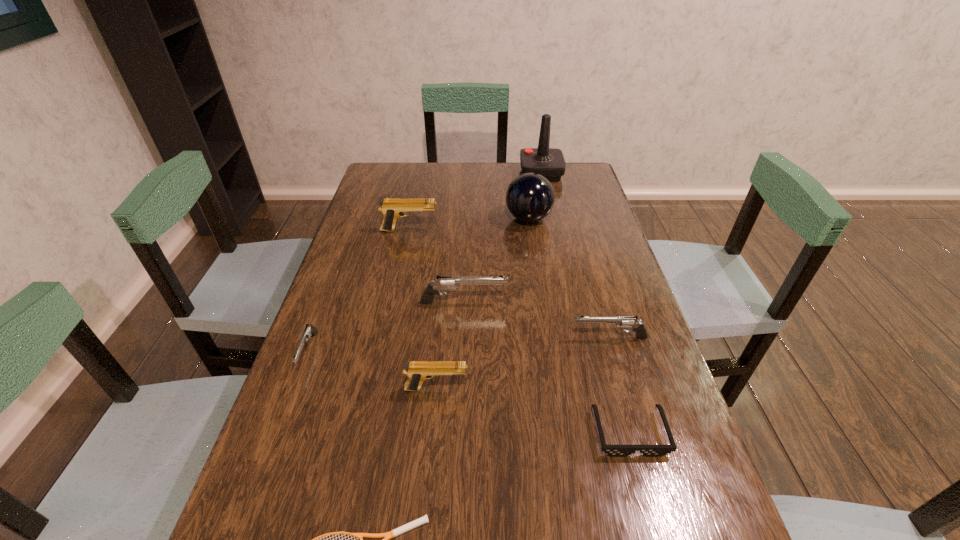
Where is `the rightmost silver pistol`? This screenshot has height=540, width=960. the rightmost silver pistol is located at coordinates (623, 322).

At what (x,y) coordinates should I click in order to perform the action: click on the fourth tallest pistol. Please return your answer as a coordinate pair (x, y). The width and height of the screenshot is (960, 540). Looking at the image, I should click on (623, 322).

The height and width of the screenshot is (540, 960). What are the coordinates of `the seventh tallest object` in the screenshot? It's located at (309, 330).

Where is `the smallest silver pistol`? the smallest silver pistol is located at coordinates (309, 330).

At what (x,y) coordinates should I click in order to perform the action: click on the second nearest object. Please return your answer as a coordinate pair (x, y). This screenshot has height=540, width=960. Looking at the image, I should click on (613, 450).

Where is `the second shortest object`? the second shortest object is located at coordinates (613, 450).

Image resolution: width=960 pixels, height=540 pixels. I want to click on vacant position located 0.380m on the left of the joystick, so click(420, 173).

The image size is (960, 540). I want to click on free space located 0.270m on the side of the second tallest object with the finger holes, so click(422, 218).

You are a GUI agent. You are given a task and a screenshot of the screen. Output one action in this format:
    pyautogui.click(x=<x>, y=<y>)
    Task: Click on the free space located 0.050m on the side of the second tallest object with the finger holes
    This screenshot has height=540, width=960.
    Given the screenshot: What is the action you would take?
    pyautogui.click(x=490, y=218)

Identify the location of vacant region located 0.060m on the side of the second tallest object with the finger holes. (487, 218).